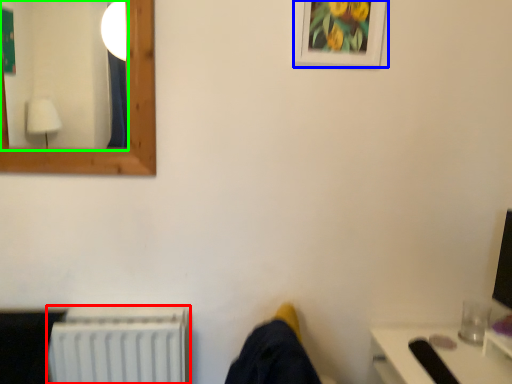
Question: Based on their relative distances, which object is nearer to radiator (highlighted by a red box)? Choose from picture frame (highlighted by a blue box) and mirror (highlighted by a green box).

Choices:
 (A) picture frame
 (B) mirror

Answer: (A)